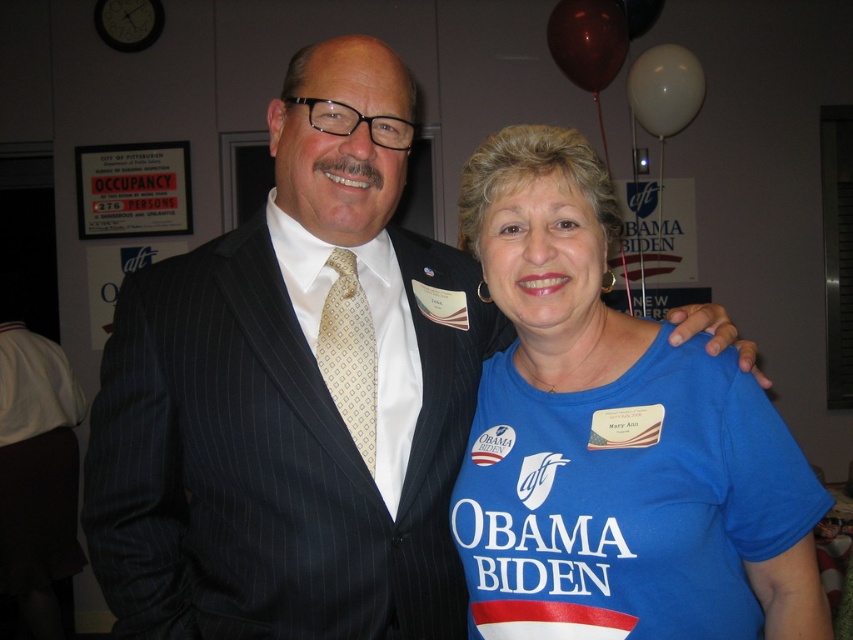
Is point (813, 624) positioned behind point (593, 52)?

That is False.

Is point (630, 573) in front of point (604, 6)?

Yes.

Locate an element on the screen. blue fabric shirt at center is located at coordinates (614, 440).

Can you confirm if dark pinstripe suit at center is thinner than white matte balloon at upper right?

In fact, dark pinstripe suit at center might be wider than white matte balloon at upper right.

Is point (314, 326) positioned after point (660, 65)?

No, it is not.

What are the coordinates of `dark pinstripe suit at center` in the screenshot? It's located at (280, 448).

Does shiny dark red balloon at upper center have a lesser width compared to shiny metallic balloon at upper right?

Incorrect, shiny dark red balloon at upper center's width is not less than shiny metallic balloon at upper right's.

Is shiny dark red balloon at upper center positioned in front of shiny metallic balloon at upper right?

Yes.

Describe the element at coordinates (587, 42) in the screenshot. The width and height of the screenshot is (853, 640). I see `shiny dark red balloon at upper center` at that location.

Where is `shiny dark red balloon at upper center`? This screenshot has width=853, height=640. shiny dark red balloon at upper center is located at coordinates (587, 42).